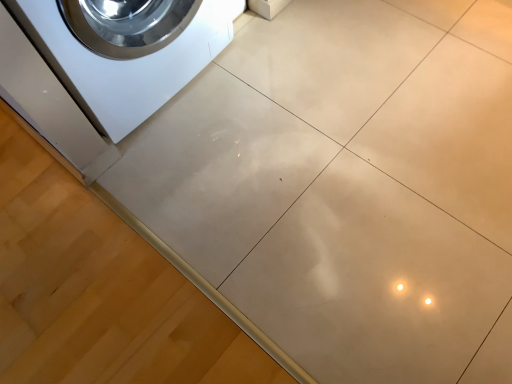
This screenshot has height=384, width=512. I want to click on white glossy washing machine at upper left, so click(125, 51).

Describe the element at coordinates (125, 51) in the screenshot. I see `white glossy washing machine at upper left` at that location.

Image resolution: width=512 pixels, height=384 pixels. Find the location of `white glossy washing machine at upper left`. white glossy washing machine at upper left is located at coordinates (125, 51).